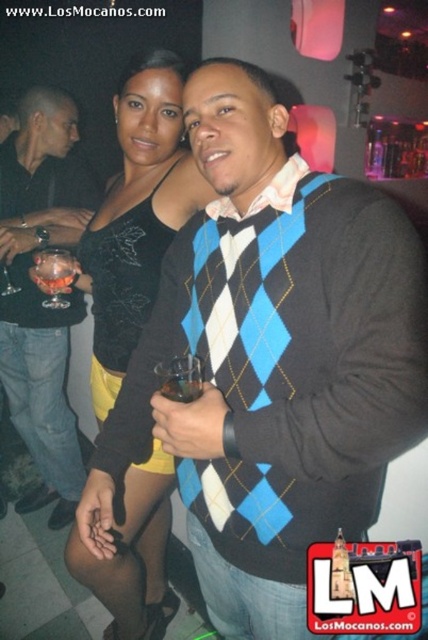
Is translucent glass cup at center taller than transparent glass at lower left?

No.

Who is more distant from viewer, (172, 400) or (5, 275)?

Point (5, 275)

You are a GUI agent. You are given a task and a screenshot of the screen. Output one action in this format:
    pyautogui.click(x=<x>, y=<y>)
    Task: Click on the translucent glass cup at center
    Image resolution: width=428 pixels, height=640 pixels.
    Given the screenshot: What is the action you would take?
    pyautogui.click(x=181, y=385)

The width and height of the screenshot is (428, 640). Find the location of `translucent glass cup at center`. translucent glass cup at center is located at coordinates [181, 385].

Which is more to the right, translucent glass at center or transparent glass at lower left?

translucent glass at center is more to the right.

The image size is (428, 640). What do you see at coordinates (180, 378) in the screenshot? I see `translucent glass at center` at bounding box center [180, 378].

Who is more distant from viewer, (180, 356) or (9, 288)?

Point (9, 288)

Identify the location of translucent glass at center. click(180, 378).

Who is more forward, [65,228] or [3,289]?

Point [65,228] is in front.

Is matte black shirt at left shorter than transparent glass at lower left?

No, matte black shirt at left is not shorter than transparent glass at lower left.

Which is in front, point (59, 403) or point (6, 282)?

Point (6, 282) is more forward.

Where is `matte black shirt at left`? This screenshot has width=428, height=640. matte black shirt at left is located at coordinates (39, 292).